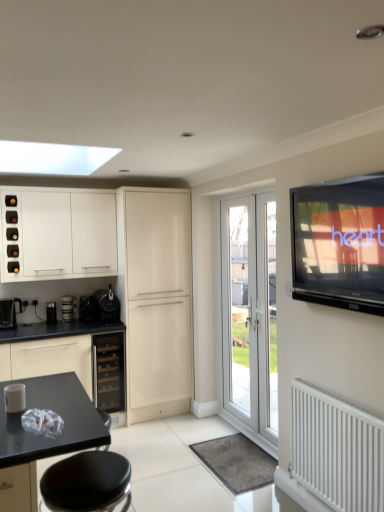
Question: From the image's perspective, is white glossy cabinet at upper left, placed as the 1th cabinetry when sorted from left to right, above or below metallic silver cup at left, marked as the 2th appliance in a left-to-right arrangement?

Choices:
 (A) below
 (B) above

Answer: (B)

Question: Considering the relative positions of white glossy cabinet at upper left, placed as the second cabinetry when sorted from right to left, and metallic silver cup at left, placed as the third appliance when sorted from right to left, in the image provided, is white glossy cabinet at upper left, placed as the second cabinetry when sorted from right to left, to the left or to the right of metallic silver cup at left, placed as the third appliance when sorted from right to left,?

Choices:
 (A) right
 (B) left

Answer: (B)

Question: Which of these objects is positioned closest to the black matte coffee maker at lower left, acting as the 3th appliance starting from the left?

Choices:
 (A) white glossy door at center
 (B) black leather bar stool at lower left
 (C) white glossy cabinet at upper left, placed as the 1th cabinetry when sorted from left to right
 (D) flat-screen tv at upper right
 (E) black plastic coffee machine at left

Answer: (E)

Question: Which is farther from the glossy cream cabinet at center, placed as the 1th cabinetry when sorted from right to left?

Choices:
 (A) satin black wine cooler at center
 (B) satin black coffee machine at lower center, positioned as the first appliance in right-to-left order
 (C) white metal radiator at lower right
 (D) black plastic coffee machine at left
 (E) white glossy door at center

Answer: (C)